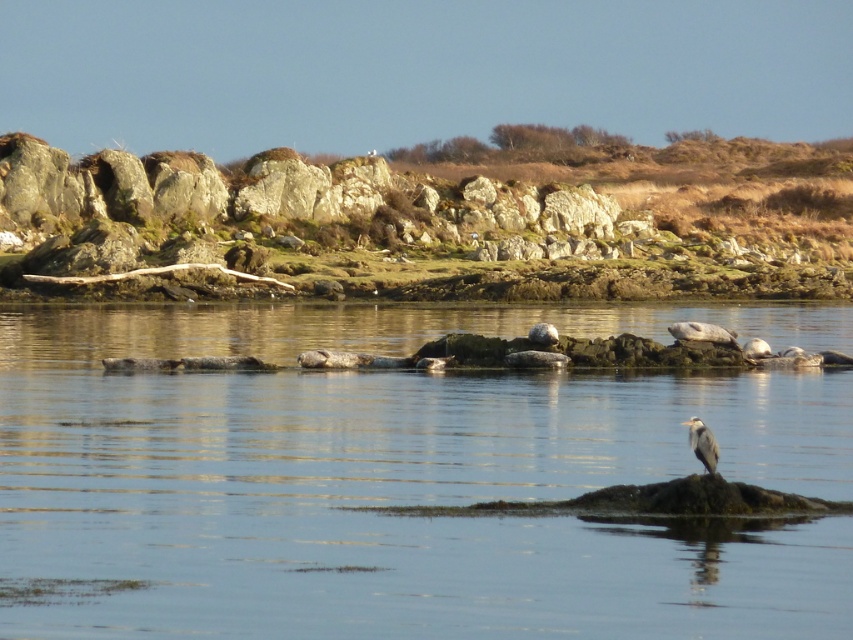
Question: Is clear water at center above gray matte bird at center?

Choices:
 (A) yes
 (B) no

Answer: (A)

Question: Which point is closer to the camera taking this photo?

Choices:
 (A) (422, 388)
 (B) (703, 429)

Answer: (B)

Question: Can you confirm if clear water at center is positioned to the right of gray matte bird at center?

Choices:
 (A) yes
 (B) no

Answer: (B)

Question: Does clear water at center have a greater width compared to gray matte bird at center?

Choices:
 (A) yes
 (B) no

Answer: (A)